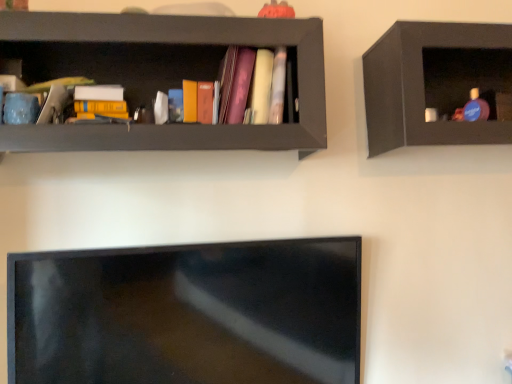
Question: Does matte black shelf at upper right, which is the 2th shelf from left to right, have a lesser height compared to matte pink book at center?

Choices:
 (A) no
 (B) yes

Answer: (A)

Question: Is matte black shelf at upper right, positioned as the first shelf in right-to-left order, at the left side of matte pink book at center?

Choices:
 (A) yes
 (B) no

Answer: (B)

Question: Is the depth of matte black shelf at upper right, positioned as the first shelf in right-to-left order, less than that of matte pink book at center?

Choices:
 (A) no
 (B) yes

Answer: (A)

Question: Does matte black shelf at upper right, positioned as the first shelf in right-to-left order, have a larger size compared to matte pink book at center?

Choices:
 (A) no
 (B) yes

Answer: (B)

Question: From a real-world perspective, is matte black shelf at upper right, which is the 2th shelf from left to right, located higher than matte pink book at center?

Choices:
 (A) yes
 (B) no

Answer: (B)

Question: Is matte black shelf at upper right, which is the 2th shelf from left to right, taller than matte pink book at center?

Choices:
 (A) yes
 (B) no

Answer: (A)

Question: Considering the relative positions of matte pink book at center and matte black shelf at upper left, the 1th shelf viewed from the left, in the image provided, is matte pink book at center to the left of matte black shelf at upper left, the 1th shelf viewed from the left, from the viewer's perspective?

Choices:
 (A) no
 (B) yes

Answer: (A)

Question: Is matte pink book at center taller than matte black shelf at upper left, the 1th shelf viewed from the left?

Choices:
 (A) yes
 (B) no

Answer: (B)

Question: Is matte pink book at center further to the viewer compared to matte black shelf at upper left, positioned as the second shelf in right-to-left order?

Choices:
 (A) no
 (B) yes

Answer: (B)

Question: From a real-world perspective, does matte pink book at center sit lower than matte black shelf at upper left, the 1th shelf viewed from the left?

Choices:
 (A) yes
 (B) no

Answer: (B)

Question: Does matte pink book at center turn towards matte black shelf at upper left, positioned as the second shelf in right-to-left order?

Choices:
 (A) yes
 (B) no

Answer: (A)

Question: Considering the relative positions of matte pink book at center and matte black shelf at upper left, positioned as the second shelf in right-to-left order, in the image provided, is matte pink book at center to the right of matte black shelf at upper left, positioned as the second shelf in right-to-left order, from the viewer's perspective?

Choices:
 (A) yes
 (B) no

Answer: (A)

Question: Is matte black shelf at upper right, which is the 2th shelf from left to right, facing towards matte black shelf at upper left, positioned as the second shelf in right-to-left order?

Choices:
 (A) no
 (B) yes

Answer: (A)